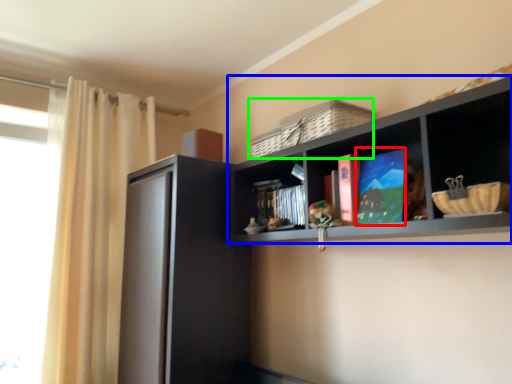
Question: Which object is positioned farthest from book (highlighted by a red box)? Select from shelf (highlighted by a blue box) and basket (highlighted by a green box).

Choices:
 (A) shelf
 (B) basket

Answer: (B)